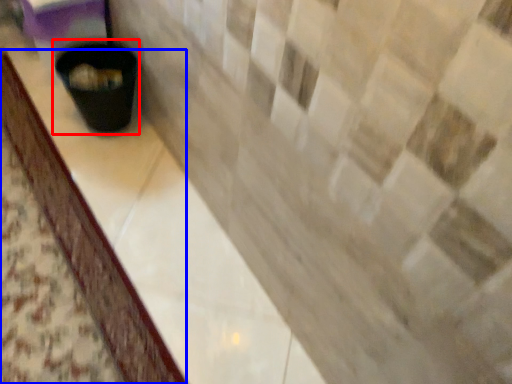
Question: Among these objects, which one is farthest to the camera, waste container (highlighted by a red box) or counter top (highlighted by a blue box)?

Choices:
 (A) waste container
 (B) counter top

Answer: (A)